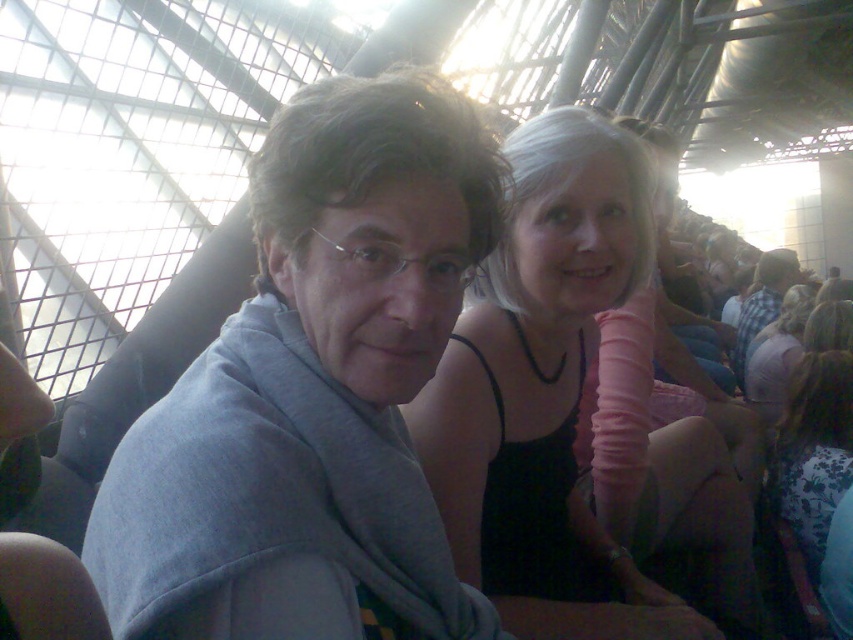
Question: Which is farther from the plaid shirt at center?

Choices:
 (A) pink fabric dress at center
 (B) black matte tank top at center

Answer: (B)

Question: Estimate the real-world distances between objects in this image. Which object is farther from the black matte tank top at center?

Choices:
 (A) plaid shirt at center
 (B) pink fabric dress at center
 (C) floral dress at lower right

Answer: (A)

Question: Can you confirm if gray fleece jacket at center is smaller than plaid shirt at center?

Choices:
 (A) yes
 (B) no

Answer: (B)

Question: Can you confirm if gray fleece jacket at center is thinner than floral dress at lower right?

Choices:
 (A) yes
 (B) no

Answer: (B)

Question: Is floral dress at lower right thinner than plaid shirt at center?

Choices:
 (A) yes
 (B) no

Answer: (B)

Question: Which point is closer to the camera?

Choices:
 (A) (614, 300)
 (B) (801, 296)

Answer: (A)